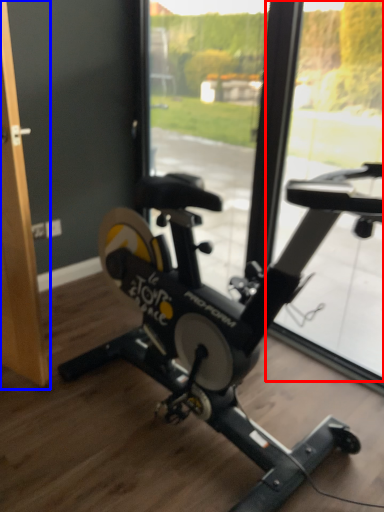
Question: Which point is further to the camera, window screen (highlighted by a red box) or screen door (highlighted by a blue box)?

Choices:
 (A) window screen
 (B) screen door

Answer: (A)